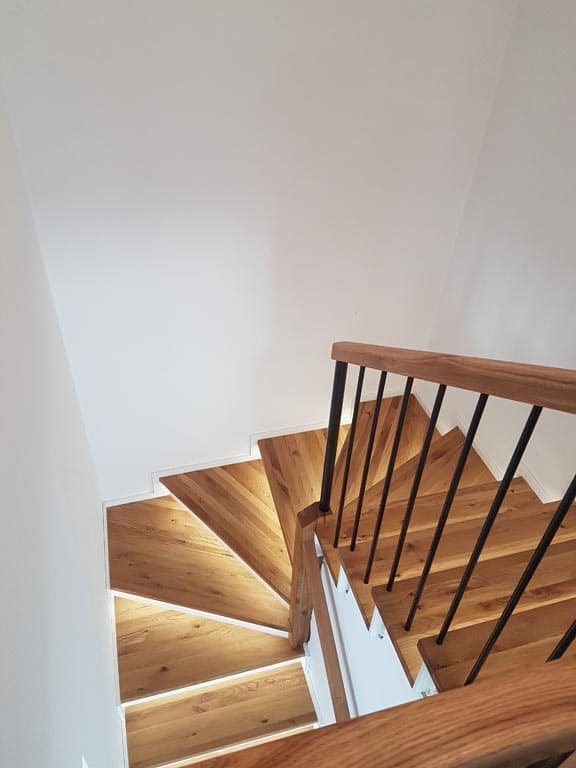
Identify the location of left side of wooden stair step planks. This screenshot has height=768, width=576. (434, 674), (390, 631), (355, 598), (327, 554).